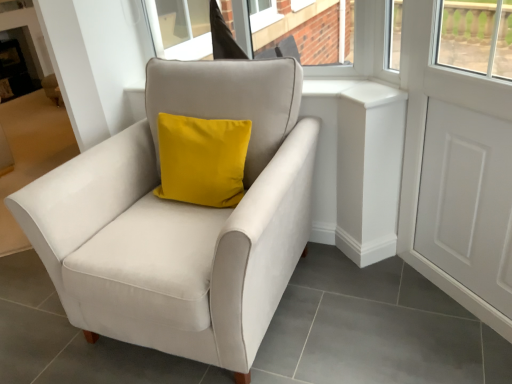
Locate an element on the screen. This screenshot has height=384, width=512. white matte screen door at right is located at coordinates (467, 200).

Describe the element at coordinates (467, 200) in the screenshot. I see `white matte screen door at right` at that location.

What is the approximate height of white matte screen door at right?

white matte screen door at right is 3.74 feet in height.

What are the coordinates of `satin beige armchair at center` in the screenshot? It's located at (181, 220).

This screenshot has width=512, height=384. Describe the element at coordinates (181, 220) in the screenshot. I see `satin beige armchair at center` at that location.

Image resolution: width=512 pixels, height=384 pixels. In order to click on white matte screen door at right in this screenshot , I will do `click(467, 200)`.

Considering the relative positions of satin beige armchair at center and white matte screen door at right in the image provided, is satin beige armchair at center to the left of white matte screen door at right from the viewer's perspective?

Yes, satin beige armchair at center is to the left of white matte screen door at right.

Between satin beige armchair at center and white matte screen door at right, which one is positioned in front?

satin beige armchair at center is closer to the camera.

Is point (270, 275) positioned after point (447, 254)?

No.

From the picture: From the image's perspective, does satin beige armchair at center appear lower than white matte screen door at right?

Yes, from the image's perspective, satin beige armchair at center is below white matte screen door at right.

From a real-world perspective, is satin beige armchair at center positioned under white matte screen door at right based on gravity?

Indeed, from a real-world perspective, satin beige armchair at center is positioned beneath white matte screen door at right.

Between satin beige armchair at center and white matte screen door at right, which one has larger width?

satin beige armchair at center.

Is satin beige armchair at center taller than white matte screen door at right?

In fact, satin beige armchair at center may be shorter than white matte screen door at right.

Considering the relative sizes of satin beige armchair at center and white matte screen door at right in the image provided, is satin beige armchair at center bigger than white matte screen door at right?

Correct, satin beige armchair at center is larger in size than white matte screen door at right.

Can we say satin beige armchair at center lies outside white matte screen door at right?

Yes, satin beige armchair at center is outside of white matte screen door at right.

From the picture: Is satin beige armchair at center with white matte screen door at right?

No.

Is satin beige armchair at center facing towards white matte screen door at right?

No.

Can you tell me how much satin beige armchair at center and white matte screen door at right differ in facing direction?

They differ by 43.4 degrees in their facing directions.

This screenshot has height=384, width=512. Find the location of `chair on the left of white matte screen door at right`. chair on the left of white matte screen door at right is located at coordinates pos(181,220).

Considering the relative positions of white matte screen door at right and satin beige armchair at center in the image provided, is white matte screen door at right to the left or to the right of satin beige armchair at center?

white matte screen door at right is positioned on satin beige armchair at center's right side.

Is white matte screen door at right positioned in front of satin beige armchair at center?

No, it is behind satin beige armchair at center.

Which is farther from the camera, (497, 231) or (158, 74)?

The point (158, 74) is behind.

From the image's perspective, is white matte screen door at right positioned above or below satin beige armchair at center?

Clearly, from the image's perspective, white matte screen door at right is above satin beige armchair at center.

From a real-world perspective, between white matte screen door at right and satin beige armchair at center, who is vertically lower?

From a 3D spatial view, satin beige armchair at center is below.

Which object is wider, white matte screen door at right or satin beige armchair at center?

With larger width is satin beige armchair at center.

In the scene shown: Who is taller, white matte screen door at right or satin beige armchair at center?

With more height is white matte screen door at right.

Who is bigger, white matte screen door at right or satin beige armchair at center?

satin beige armchair at center.

Is white matte screen door at right located outside satin beige armchair at center?

Yes, white matte screen door at right is not within satin beige armchair at center.

Is there a large distance between white matte screen door at right and satin beige armchair at center?

They are positioned close to each other.

Is white matte screen door at right facing towards satin beige armchair at center?

Yes, white matte screen door at right faces towards satin beige armchair at center.

What's the angular difference between white matte screen door at right and satin beige armchair at center's facing directions?

The angular difference between white matte screen door at right and satin beige armchair at center is 43.4 degrees.

Identify the location of screen door located above the satin beige armchair at center (from a real-world perspective). This screenshot has height=384, width=512. (467, 200).

The width and height of the screenshot is (512, 384). I want to click on chair that is in front of the white matte screen door at right, so click(x=181, y=220).

Find the location of `chair lying on the left of white matte screen door at right`. chair lying on the left of white matte screen door at right is located at coordinates (181, 220).